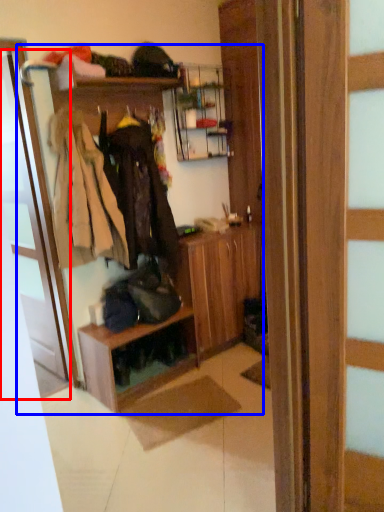
Question: Which object is closer to the camera taking this photo, door (highlighted by a red box) or dresser (highlighted by a blue box)?

Choices:
 (A) door
 (B) dresser

Answer: (B)